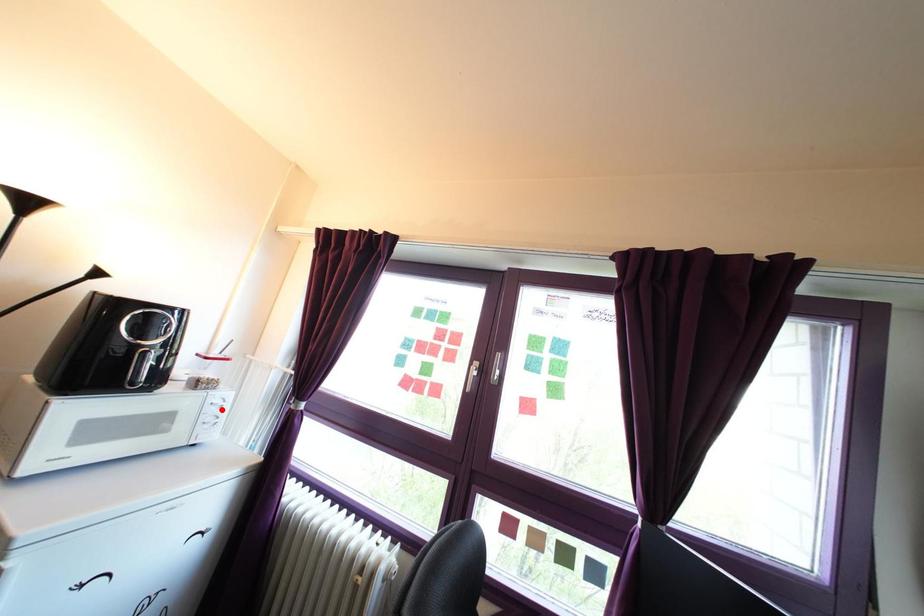
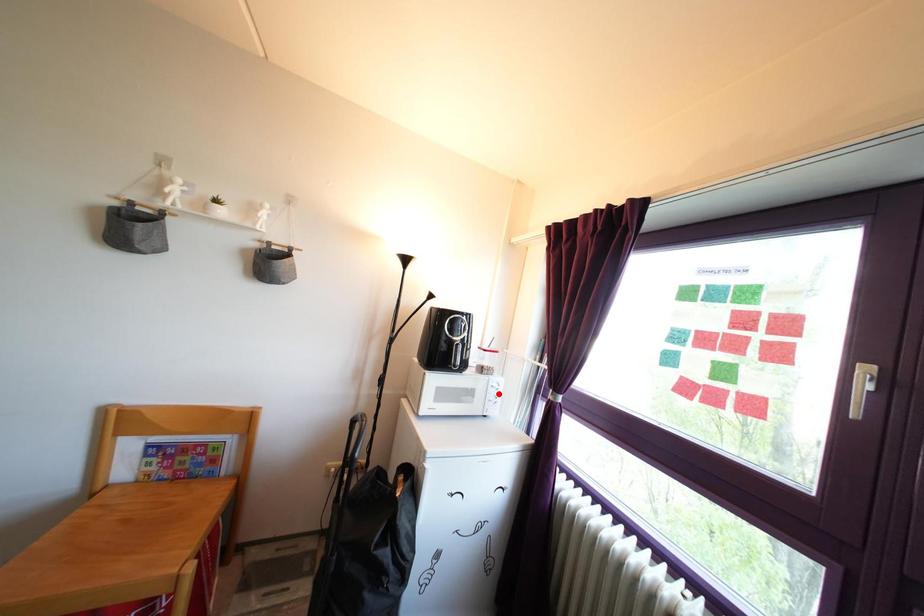
I am providing you with two images of the same scene from different viewpoints. A red point is marked on the first image and another point is marked on the second image. Is the marked point in image1 the same physical position as the marked point in image2?

Yes